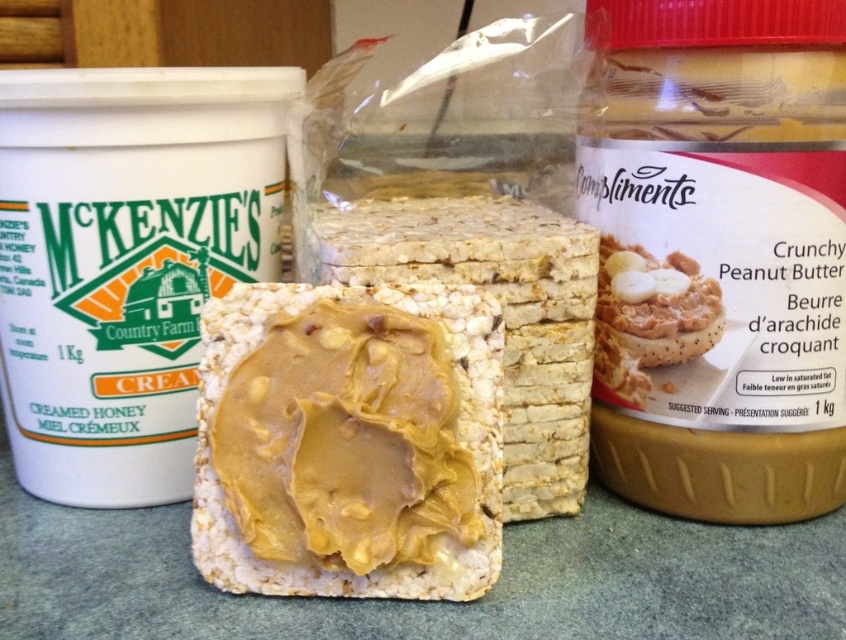
Is smooth peanut butter rice cake at center below crunchy peanut butter spread at upper right?

Yes, smooth peanut butter rice cake at center is below crunchy peanut butter spread at upper right.

Is smooth peanut butter rice cake at center thinner than crunchy peanut butter spread at upper right?

Incorrect, smooth peanut butter rice cake at center's width is not less than crunchy peanut butter spread at upper right's.

Who is more forward, (213, 330) or (662, 292)?

Point (213, 330) is more forward.

Where is `smooth peanut butter rice cake at center`? smooth peanut butter rice cake at center is located at coordinates (349, 442).